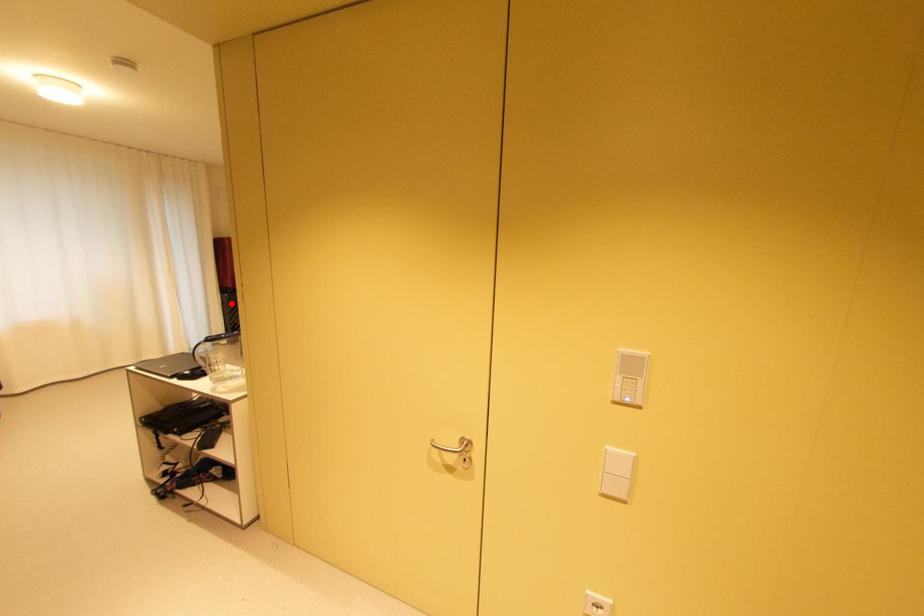
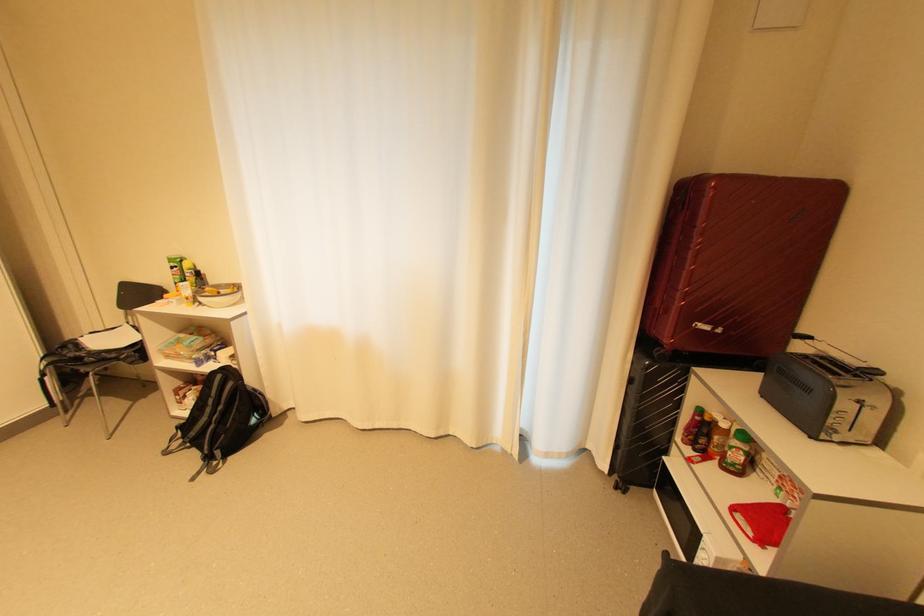
In the second image, find the point that corresponds to the highlighted location in the first image.

(638, 381)